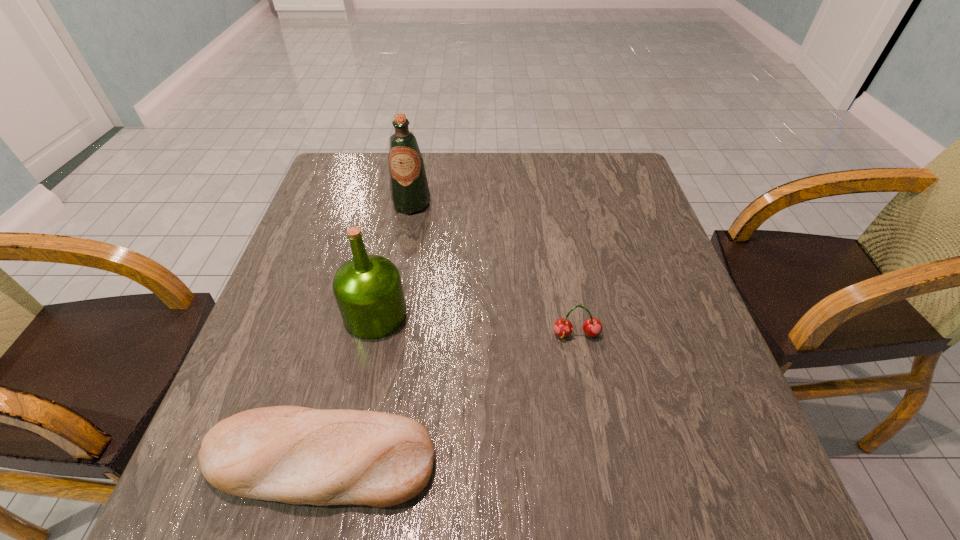
Find the location of a particular element. object that is at the left edge is located at coordinates (298, 455).

The width and height of the screenshot is (960, 540). I want to click on object present at the near left corner, so click(298, 455).

Find the location of a particular element. free space at the far edge of the desktop is located at coordinates coord(516,183).

In the image, there is a desktop. Where is `free space at the near edge`? Image resolution: width=960 pixels, height=540 pixels. free space at the near edge is located at coordinates (526, 504).

In the image, there is a desktop. At what (x,y) coordinates should I click in order to perform the action: click on vacant space at the left edge. Please return your answer as a coordinate pair (x, y). Image resolution: width=960 pixels, height=540 pixels. Looking at the image, I should click on (330, 229).

You are a GUI agent. You are given a task and a screenshot of the screen. Output one action in this format:
    pyautogui.click(x=<x>, y=<y>)
    Task: Click on the free space at the right edge of the desktop
    The height and width of the screenshot is (540, 960).
    Given the screenshot: What is the action you would take?
    pyautogui.click(x=606, y=205)

The width and height of the screenshot is (960, 540). I want to click on vacant position at the far left corner of the desktop, so click(357, 191).

I want to click on free space at the near right corner of the desktop, so click(750, 504).

Find the location of a particular element. The image size is (960, 540). free space between the cherry and the farther olive oil is located at coordinates (493, 269).

Image resolution: width=960 pixels, height=540 pixels. In order to click on free area in between the nearer olive oil and the nearest object in this screenshot , I will do `click(348, 387)`.